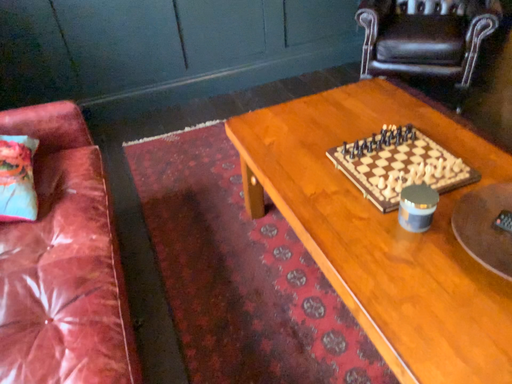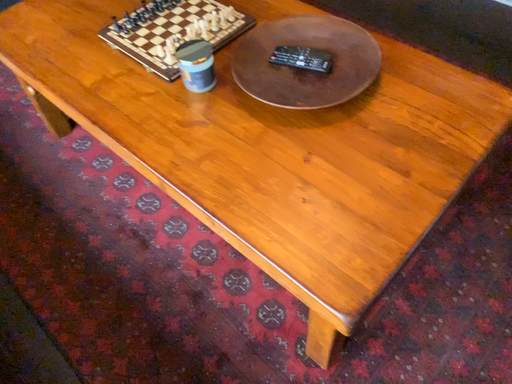
Question: How did the camera likely rotate when shooting the video?

Choices:
 (A) rotated right
 (B) rotated left

Answer: (A)